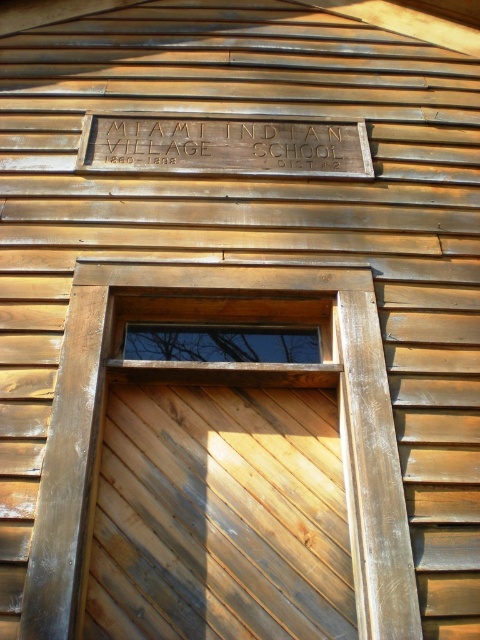
You are standing in front of the wooden building and notice both the wooden frame window at center and the wooden sign at center. According to their positions, which object is located to the left?

The wooden sign at center is located to the left of the wooden frame window at center.

You are standing in front of the wooden building depicted in the image. You need to locate the wooden frame window at center. Where exactly is it positioned?

The wooden frame window at center is positioned at point [340,433].